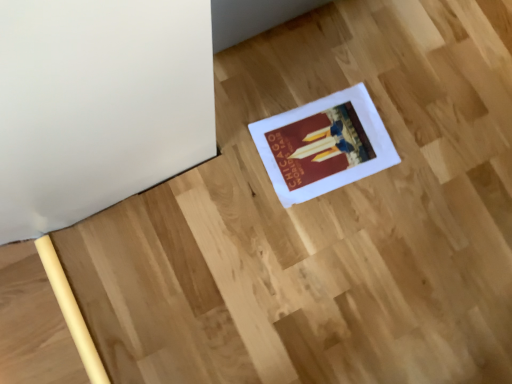
Locate an element on the screen. vacant space to the right of white matte picture frame at center is located at coordinates (418, 182).